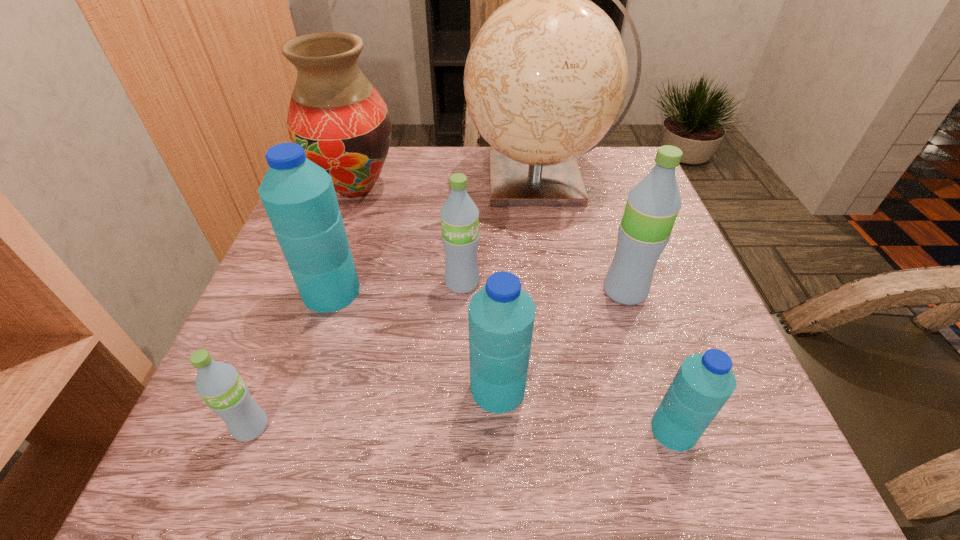
I want to click on vacant space situated on the back of the smallest green water bottle, so click(x=282, y=347).

You are a GUI agent. You are given a task and a screenshot of the screen. Output one action in this format:
    pyautogui.click(x=<x>, y=<y>)
    Task: Click on the globe that is at the far edge
    The image size is (960, 540).
    Given the screenshot: What is the action you would take?
    pyautogui.click(x=546, y=76)

You are a GUI agent. You are given a task and a screenshot of the screen. Output one action in this format:
    pyautogui.click(x=<x>, y=<y>)
    Task: Click on the vase located at the far edge
    The height and width of the screenshot is (540, 960).
    Given the screenshot: What is the action you would take?
    pyautogui.click(x=341, y=121)

Find the location of a particular element. Image resolution: width=960 pixels, height=540 pixels. vase located in the left edge section of the desktop is located at coordinates (341, 121).

The image size is (960, 540). What are the coordinates of `globe at the right edge` in the screenshot? It's located at (546, 76).

The width and height of the screenshot is (960, 540). In order to click on object at the far left corner in this screenshot , I will do `click(341, 121)`.

You are a GUI agent. You are given a task and a screenshot of the screen. Output one action in this format:
    pyautogui.click(x=<x>, y=<y>)
    Task: Click on the object positioned at the near left corner
    Image resolution: width=960 pixels, height=540 pixels.
    Given the screenshot: What is the action you would take?
    pyautogui.click(x=219, y=384)

Locate an element on the screen. The image size is (960, 540). object that is at the far right corner is located at coordinates (546, 76).

Where is `object that is at the near right corner`? This screenshot has height=540, width=960. object that is at the near right corner is located at coordinates (704, 382).

The width and height of the screenshot is (960, 540). Find the location of `free space at the far edge of the desktop`. free space at the far edge of the desktop is located at coordinates (439, 173).